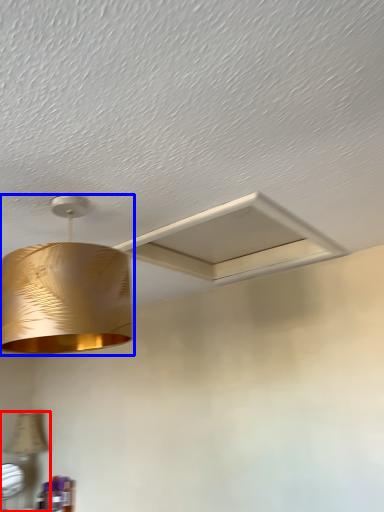
Question: Among these objects, which one is farthest to the camera, lamp (highlighted by a red box) or lamp (highlighted by a blue box)?

Choices:
 (A) lamp
 (B) lamp

Answer: (A)